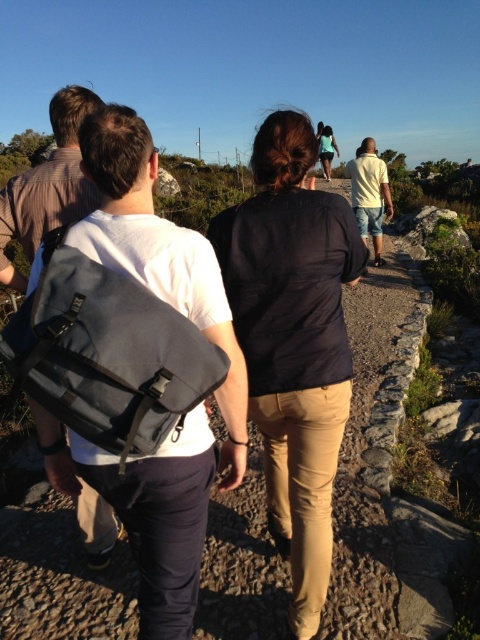
Question: Does gray fabric backpack at left have a smaller size compared to gray fabric backpack at center?

Choices:
 (A) yes
 (B) no

Answer: (B)

Question: Which point appears farthest from the camera in this image?

Choices:
 (A) (144, 358)
 (B) (134, 144)
 (C) (369, 186)
 (D) (233, 259)

Answer: (C)

Question: Is the position of gray fabric backpack at left more distant than that of yellow cotton shirt at center?

Choices:
 (A) no
 (B) yes

Answer: (A)

Question: Among these points, which one is farthest from the camera?

Choices:
 (A) (380, 186)
 (B) (302, 586)
 (C) (96, 248)

Answer: (A)

Question: Is gray fabric backpack at left to the left of gray fabric backpack at center from the viewer's perspective?

Choices:
 (A) no
 (B) yes

Answer: (B)

Question: Estimate the real-world distances between objects in this image. Which object is farther from the black fabric shirt at center?

Choices:
 (A) gray fabric backpack at center
 (B) gray fabric backpack at left

Answer: (A)